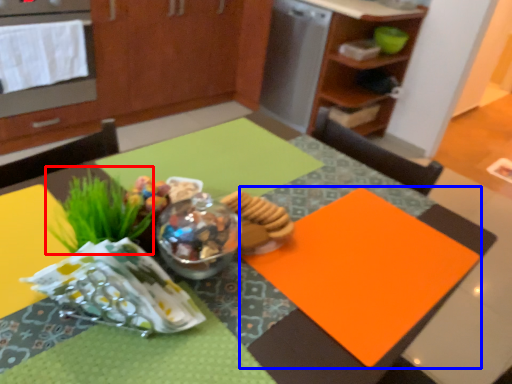
Question: Among these objects, which one is nearest to the camera, grass (highlighted by a red box) or place mat (highlighted by a blue box)?

Choices:
 (A) grass
 (B) place mat

Answer: (A)